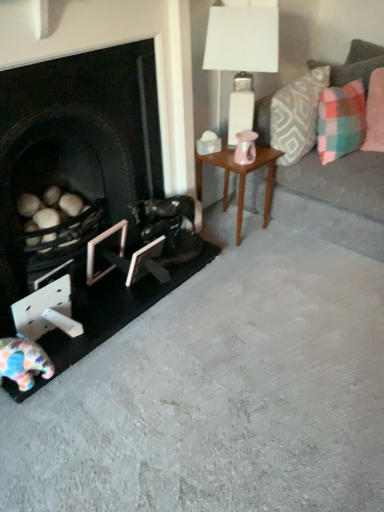
Question: From the image's perspective, would you say pink fabric pillow at upper right, which is the 3th pillow from left to right, is shown under wooden side table at center?

Choices:
 (A) no
 (B) yes

Answer: (A)

Question: From a real-world perspective, is pink fabric pillow at upper right, which is counted as the 1th pillow, starting from the right, over wooden side table at center?

Choices:
 (A) yes
 (B) no

Answer: (A)

Question: Is pink fabric pillow at upper right, which is counted as the 1th pillow, starting from the right, to the left of wooden side table at center from the viewer's perspective?

Choices:
 (A) yes
 (B) no

Answer: (B)

Question: Is pink fabric pillow at upper right, which is the 3th pillow from left to right, wider than wooden side table at center?

Choices:
 (A) yes
 (B) no

Answer: (B)

Question: Is the depth of pink fabric pillow at upper right, which is the 3th pillow from left to right, greater than that of wooden side table at center?

Choices:
 (A) yes
 (B) no

Answer: (A)

Question: Is point (218, 24) positioned closer to the camera than point (94, 272)?

Choices:
 (A) closer
 (B) farther

Answer: (A)

Question: Visually, is white glossy table lamp at upper right positioned to the left or to the right of metallic silver picture frame at lower left, the 1th picture frame positioned from the left?

Choices:
 (A) left
 (B) right

Answer: (B)

Question: In terms of height, does white glossy table lamp at upper right look taller or shorter compared to metallic silver picture frame at lower left, arranged as the second picture frame when viewed from the right?

Choices:
 (A) short
 (B) tall

Answer: (B)

Question: In the image, is white glossy table lamp at upper right positioned in front of or behind metallic silver picture frame at lower left, arranged as the second picture frame when viewed from the right?

Choices:
 (A) behind
 (B) front

Answer: (B)

Question: Looking at their shapes, would you say plaid fabric pillow at upper right, which is the 3th pillow from right to left, is wider or thinner than white glossy table lamp at upper right?

Choices:
 (A) wide
 (B) thin

Answer: (A)

Question: Considering the positions of plaid fabric pillow at upper right, which is the 3th pillow from right to left, and white glossy table lamp at upper right in the image, is plaid fabric pillow at upper right, which is the 3th pillow from right to left, bigger or smaller than white glossy table lamp at upper right?

Choices:
 (A) small
 (B) big

Answer: (A)

Question: Is point (271, 117) closer or farther from the camera than point (251, 46)?

Choices:
 (A) farther
 (B) closer

Answer: (A)

Question: Considering the positions of plaid fabric pillow at upper right, the 1th pillow in the left-to-right sequence, and white glossy table lamp at upper right in the image, is plaid fabric pillow at upper right, the 1th pillow in the left-to-right sequence, taller or shorter than white glossy table lamp at upper right?

Choices:
 (A) tall
 (B) short

Answer: (B)

Question: Would you say white glossy table lamp at upper right is to the left or to the right of white matte picture frame at lower center, the 2th picture frame viewed from the left, in the picture?

Choices:
 (A) left
 (B) right

Answer: (B)

Question: From a real-world perspective, is white glossy table lamp at upper right above or below white matte picture frame at lower center, which is counted as the 1th picture frame, starting from the right?

Choices:
 (A) below
 (B) above

Answer: (B)